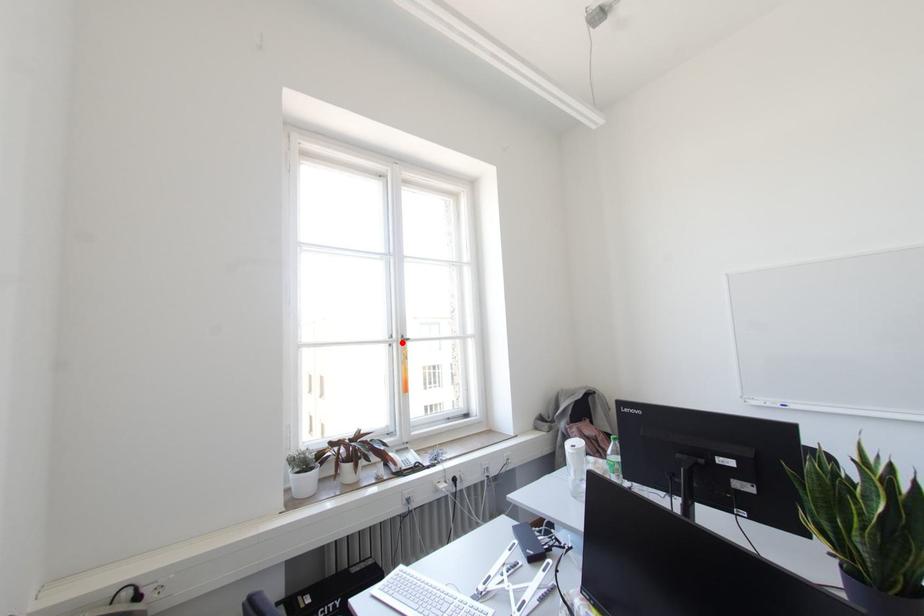
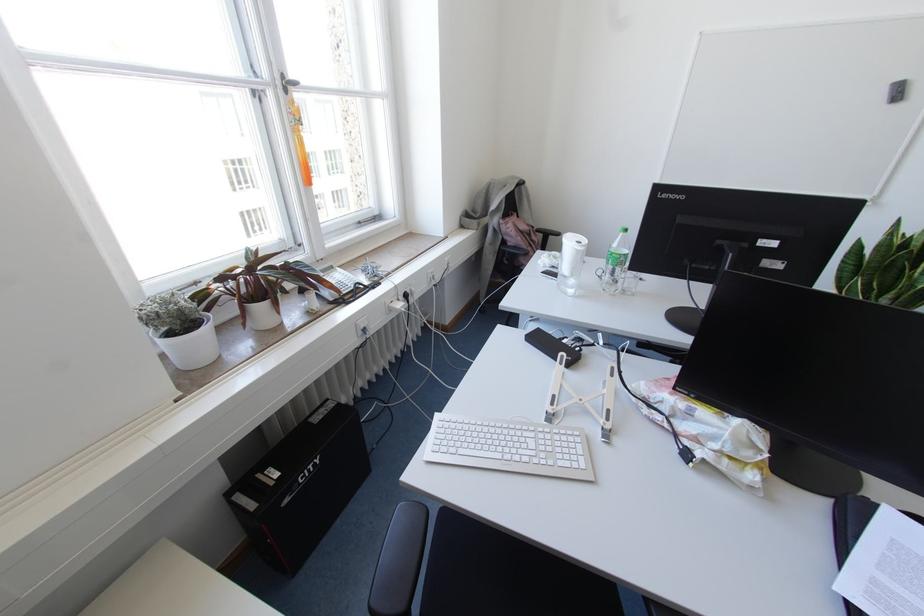
Locate, in the second image, the point that corresponds to the highlighted location in the first image.

(285, 90)